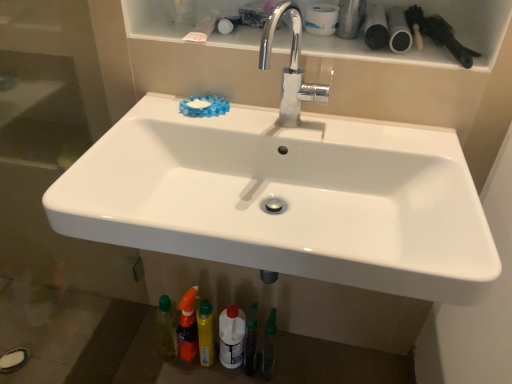
Question: Is black matte brush at upper right spatially inside white matte toilet paper at upper center, or outside of it?

Choices:
 (A) inside
 (B) outside

Answer: (B)

Question: In terms of size, does black matte brush at upper right appear bigger or smaller than white matte toilet paper at upper center?

Choices:
 (A) big
 (B) small

Answer: (A)

Question: Considering the real-world distances, which object is farthest from the black matte brush at upper right?

Choices:
 (A) white plastic bottle at lower center
 (B) chrome metallic faucet at upper center
 (C) white matte toilet paper at upper center
 (D) white glossy shelf at upper center
 (E) translucent orange spray bottle at lower center, the second toiletry positioned from the right

Answer: (E)

Question: Estimate the real-world distances between objects in this image. Which object is farther from the white glossy shelf at upper center?

Choices:
 (A) white glossy sink at center
 (B) black matte brush at upper right
 (C) translucent orange spray bottle at lower center, the second toiletry positioned from the right
 (D) white plastic bottle at lower center
 (E) translucent plastic bottle at lower center, which appears as the second toiletry when viewed from the left

Answer: (E)